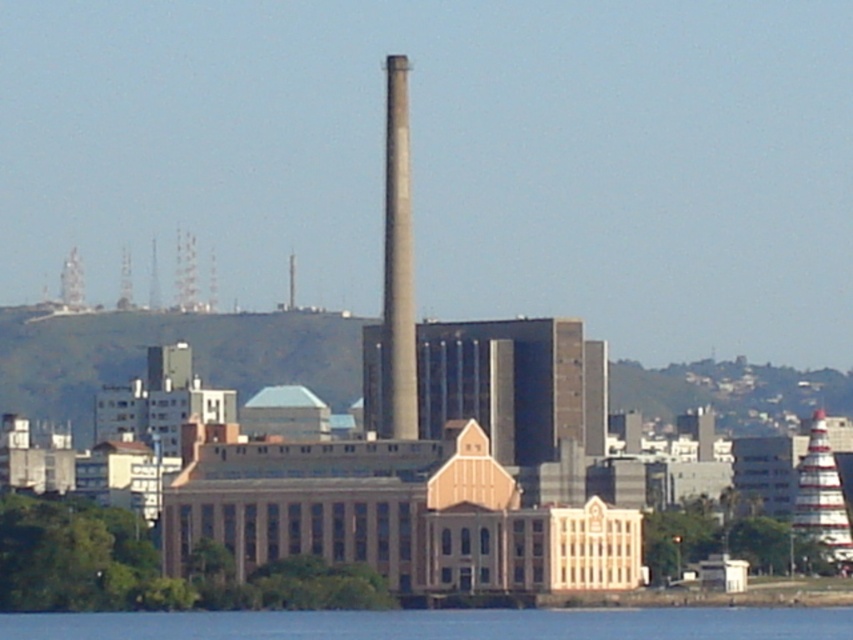
From the picture: Does blue water at lower center lie behind gray concrete tower at center?

Yes, it is.

Does blue water at lower center have a greater height compared to gray concrete tower at center?

In fact, blue water at lower center may be shorter than gray concrete tower at center.

Where is `blue water at lower center`? The width and height of the screenshot is (853, 640). blue water at lower center is located at coordinates (442, 625).

Locate an element on the screen. blue water at lower center is located at coordinates (442, 625).

Does blue water at lower center have a lesser height compared to white striped tower at right?

Yes.

What are the coordinates of `blue water at lower center` in the screenshot? It's located at (442, 625).

Who is more forward, (393, 196) or (811, 492)?

Point (393, 196) is in front.

The height and width of the screenshot is (640, 853). What do you see at coordinates (397, 266) in the screenshot?
I see `gray concrete tower at center` at bounding box center [397, 266].

Between point (398, 209) and point (811, 531), which one is positioned behind?

The point (811, 531) is more distant.

Locate an element on the screen. The width and height of the screenshot is (853, 640). gray concrete tower at center is located at coordinates (397, 266).